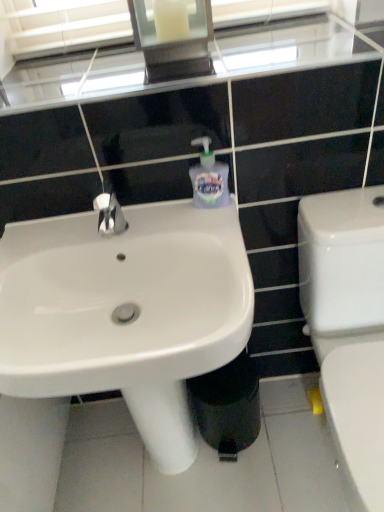
You are a GUI agent. You are given a task and a screenshot of the screen. Output one action in this format:
    pyautogui.click(x=<x>, y=<y>)
    Task: Click on the free region under black plastic trash bin/can at lower center (from a real-world perspective)
    The width and height of the screenshot is (384, 512).
    Given the screenshot: What is the action you would take?
    pyautogui.click(x=228, y=452)